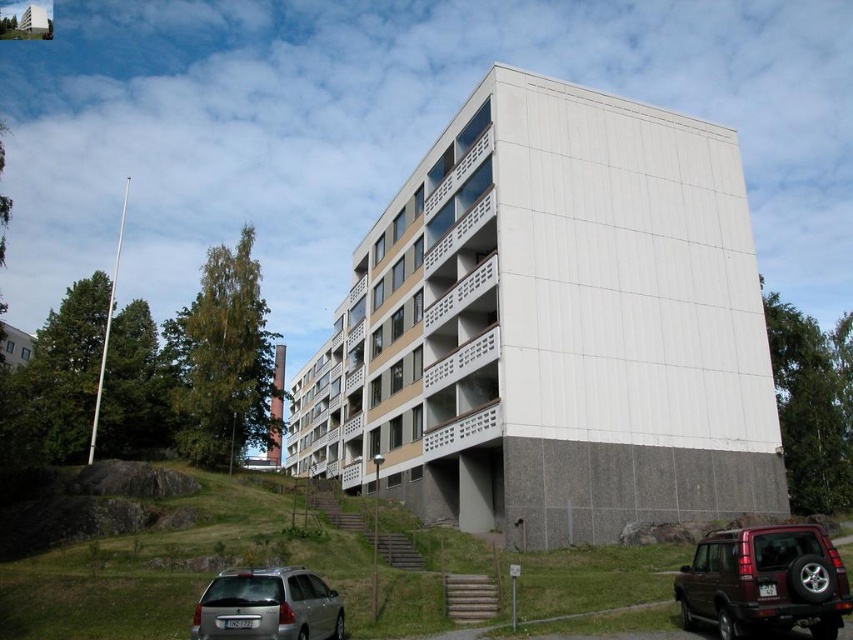
Is shiny maroon suv at lower right above silver metallic station wagon at lower left?

Indeed, shiny maroon suv at lower right is positioned over silver metallic station wagon at lower left.

Is point (721, 620) positioned in front of point (216, 584)?

Yes, it is in front of point (216, 584).

Who is more forward, [775,596] or [199,628]?

Positioned in front is point [775,596].

Locate an element on the screen. The width and height of the screenshot is (853, 640). shiny maroon suv at lower right is located at coordinates (764, 580).

Looking at this image, is green grass at lower center bigger than silver metallic station wagon at lower left?

Yes.

What do you see at coordinates (213, 572) in the screenshot? I see `green grass at lower center` at bounding box center [213, 572].

In order to click on green grass at lower center in this screenshot , I will do `click(213, 572)`.

Can you confirm if green grass at lower center is bigger than shiny maroon suv at lower right?

Correct, green grass at lower center is larger in size than shiny maroon suv at lower right.

At what (x,y) coordinates should I click in order to perform the action: click on green grass at lower center. Please return your answer as a coordinate pair (x, y). This screenshot has width=853, height=640. Looking at the image, I should click on (213, 572).